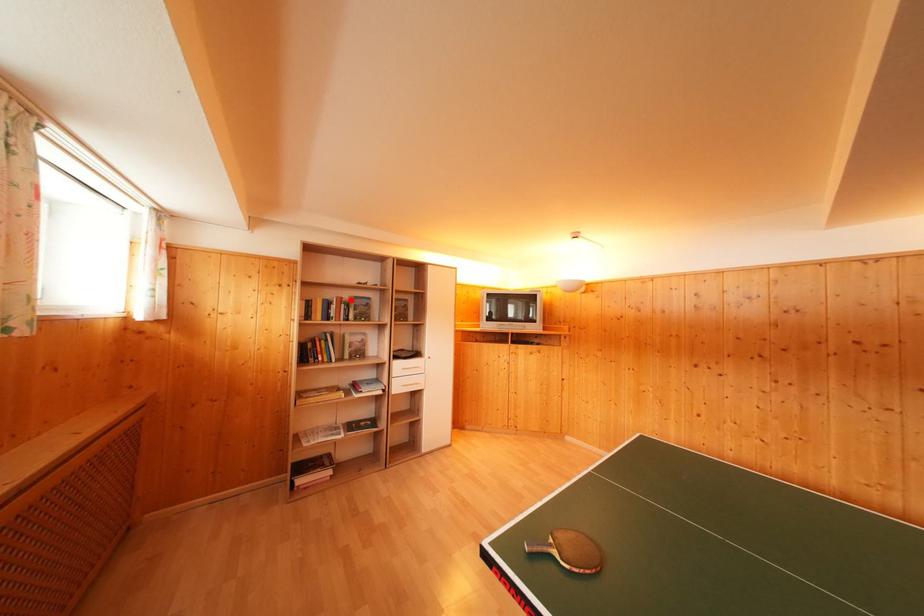
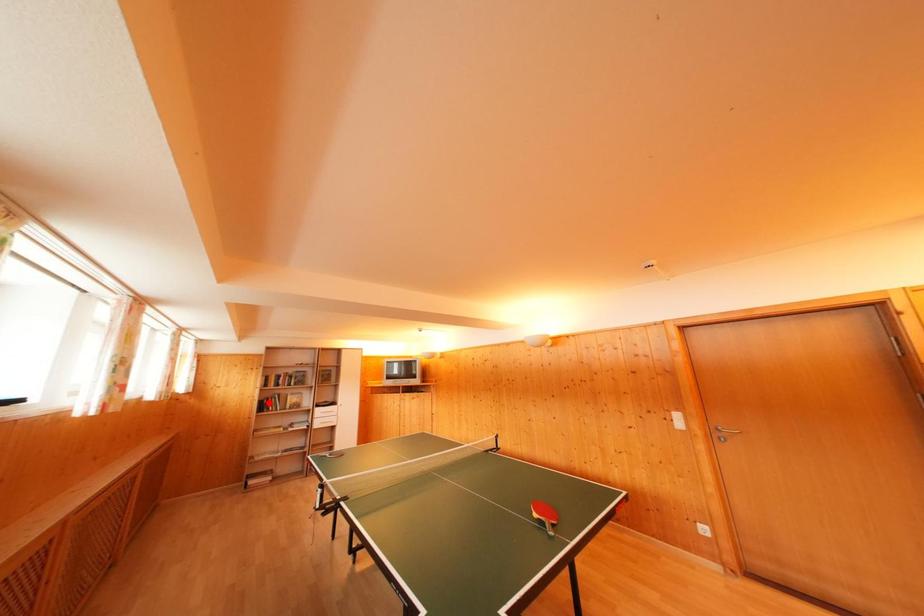
I am providing you with two images of the same scene from different viewpoints. A red point is marked on the first image and another point is marked on the second image. Do the highlighted points in image1 and image2 indicate the same real-world spot?

No